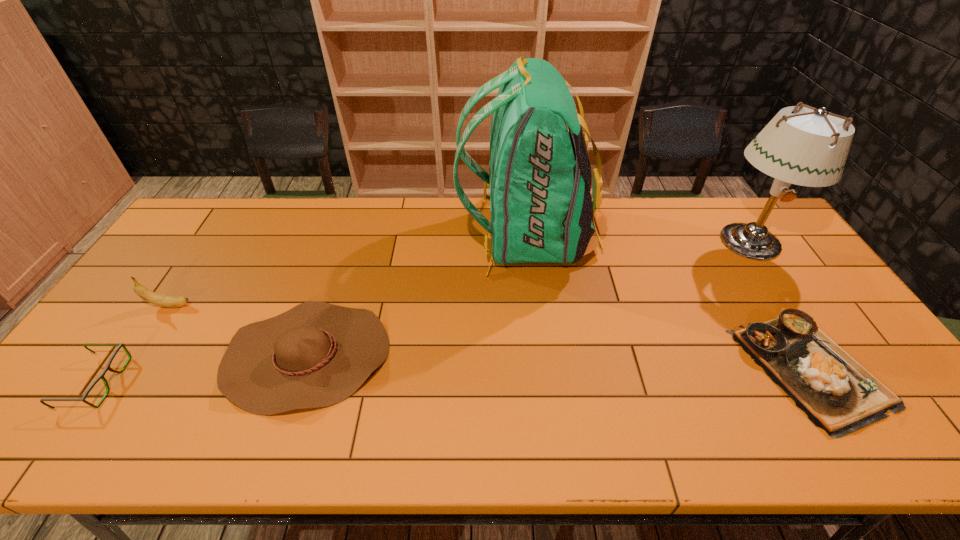
At what (x,y) coordinates should I click in order to perform the action: click on vacant space that satisfies the following two spatial constraints: 1. at the start of the peel on the platter; 2. on the right side of the banana. Please return your answer as a coordinate pair (x, y). The height and width of the screenshot is (540, 960). Looking at the image, I should click on (131, 366).

Where is `free space that satisfies the following two spatial constraints: 1. on the back side of the third object from left to right; 2. at the start of the peel on the third tallest object`? free space that satisfies the following two spatial constraints: 1. on the back side of the third object from left to right; 2. at the start of the peel on the third tallest object is located at coordinates (323, 306).

At what (x,y) coordinates should I click in order to perform the action: click on free space that satisfies the following two spatial constraints: 1. at the start of the peel on the third object from left to right; 2. on the left side of the third tallest object. Please return your answer as a coordinate pair (x, y). The width and height of the screenshot is (960, 540). Looking at the image, I should click on [138, 356].

Locate an element on the screen. free location that satisfies the following two spatial constraints: 1. on the lampshade of the fifth shortest object; 2. on the lens of the spectacles is located at coordinates (842, 382).

Where is `vacant space that satisfies the following two spatial constraints: 1. on the front side of the platter; 2. on the lens of the spectacles`? vacant space that satisfies the following two spatial constraints: 1. on the front side of the platter; 2. on the lens of the spectacles is located at coordinates (818, 382).